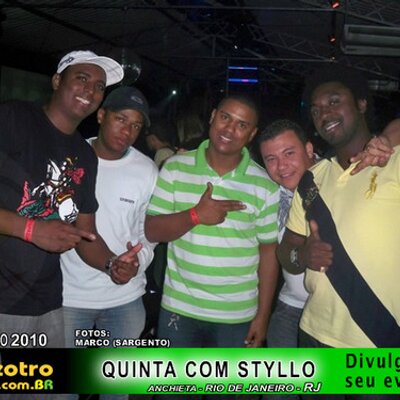
Locate an element on the screen. The height and width of the screenshot is (400, 400). ceiling light is located at coordinates (332, 57), (334, 38), (335, 3), (175, 91), (235, 47), (251, 79), (247, 67).